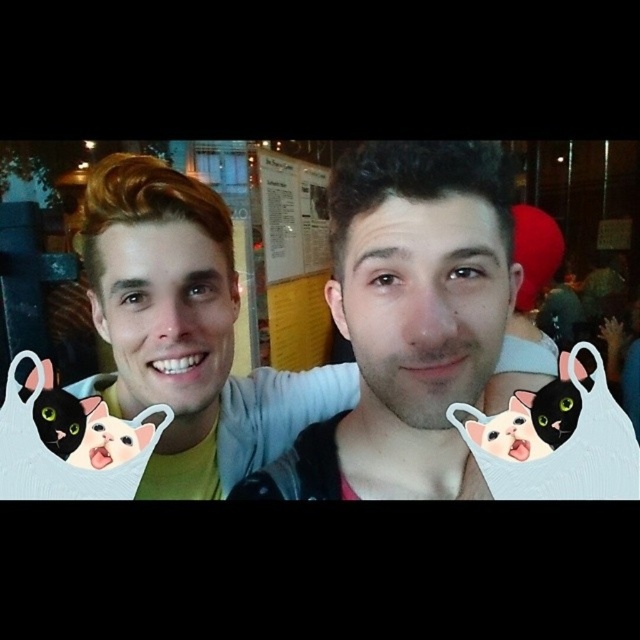
Question: Is matte yellow shirt at left below black matte cat at left?

Choices:
 (A) yes
 (B) no

Answer: (B)

Question: Which is nearer to the black matte cat at left?

Choices:
 (A) matte white shirt at center
 (B) smooth skin face at center
 (C) matte yellow shirt at left

Answer: (C)

Question: Which object appears farthest from the camera in this image?

Choices:
 (A) matte white shirt at center
 (B) matte yellow shirt at left
 (C) smooth skin face at center
 (D) black matte cat at left

Answer: (B)

Question: Is matte white shirt at center bigger than black matte cat at left?

Choices:
 (A) no
 (B) yes

Answer: (B)

Question: Does matte white shirt at center appear on the left side of black matte cat at left?

Choices:
 (A) no
 (B) yes

Answer: (A)

Question: Among these objects, which one is nearest to the camera?

Choices:
 (A) matte yellow shirt at left
 (B) matte white shirt at center
 (C) black matte cat at left
 (D) smooth skin face at center

Answer: (B)